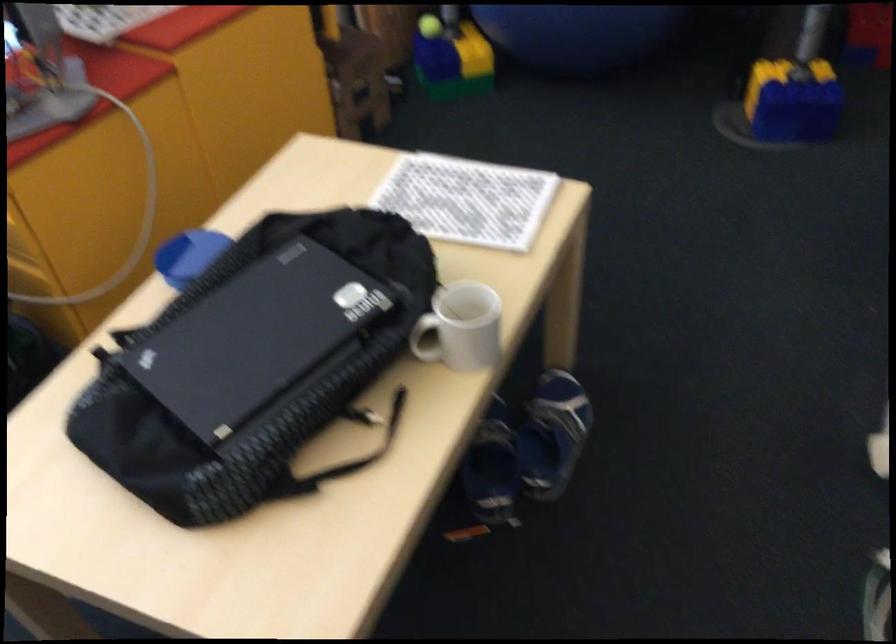
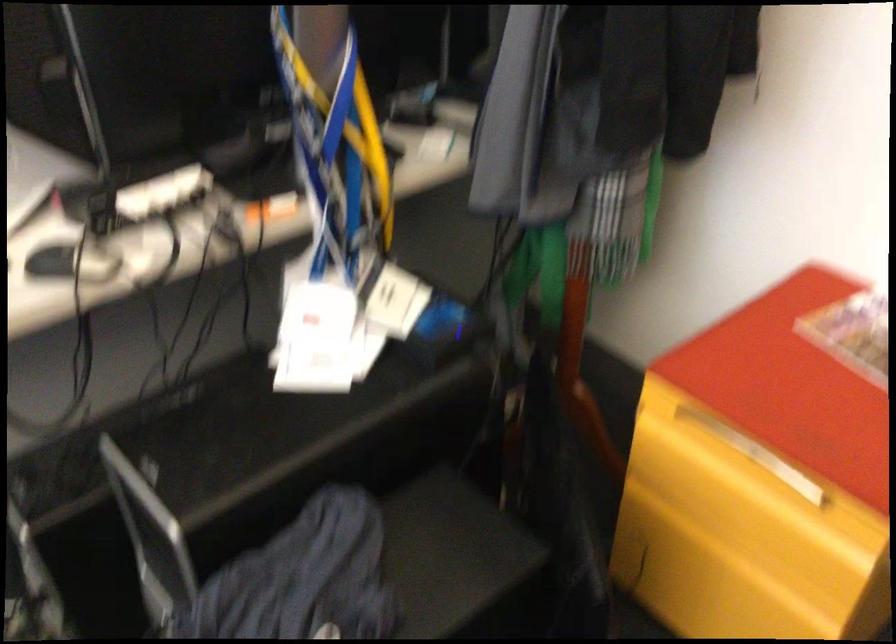
Question: The first image is from the beginning of the video and the second image is from the end. How did the camera likely rotate when shooting the video?

Choices:
 (A) Left
 (B) Right
 (C) Up
 (D) Down

Answer: (B)